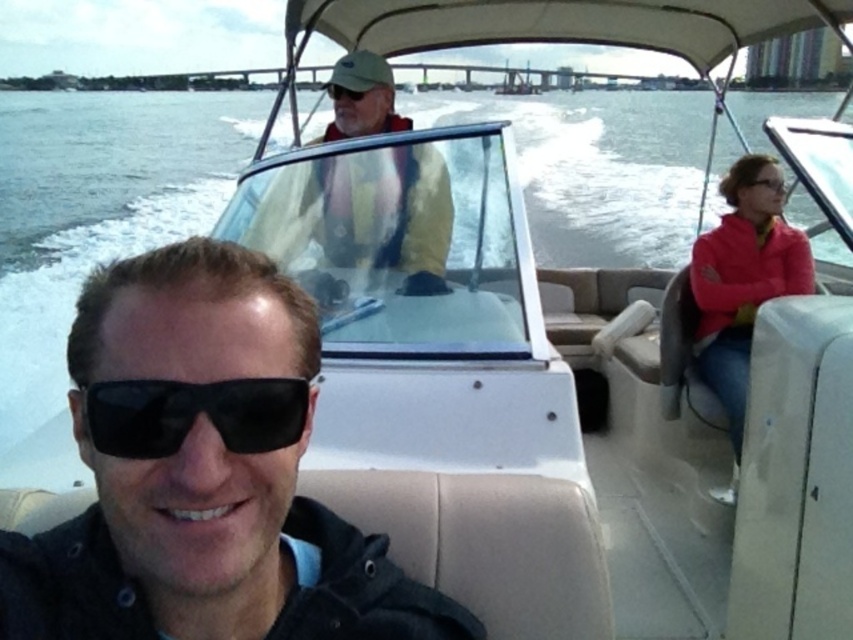
Question: Among these objects, which one is farthest from the camera?

Choices:
 (A) black matte sunglasses at lower left
 (B) black matte sunglasses at center
 (C) yellow matte jacket at upper center
 (D) matte black sunglasses at upper right

Answer: (C)

Question: Is black matte sunglasses at center wider than black matte sunglasses at lower left?

Choices:
 (A) yes
 (B) no

Answer: (A)

Question: Can you confirm if matte red jacket at right is bigger than matte black sunglasses at upper right?

Choices:
 (A) yes
 (B) no

Answer: (A)

Question: Does clear water at center appear over black matte sunglasses at lower left?

Choices:
 (A) no
 (B) yes

Answer: (B)

Question: Which object is positioned farthest from the yellow matte jacket at upper center?

Choices:
 (A) clear water at center
 (B) matte black sunglasses at upper right
 (C) black matte sunglasses at center

Answer: (A)

Question: Which point is farther to the camera?

Choices:
 (A) black matte sunglasses at center
 (B) black matte sunglasses at lower left
 (C) yellow matte jacket at upper center

Answer: (C)